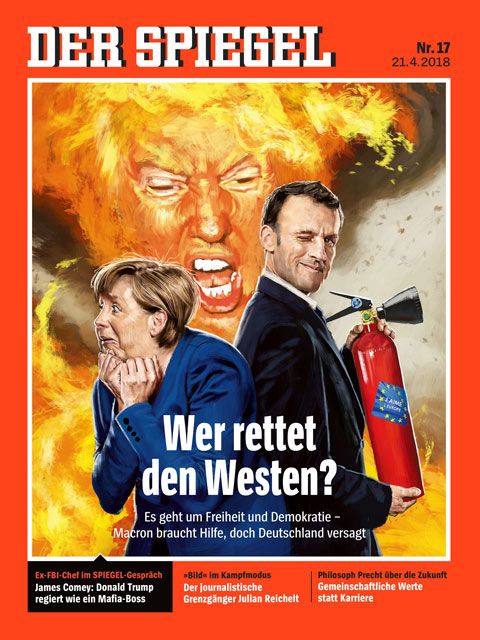
I want to click on fire extinguisher, so click(x=377, y=363).